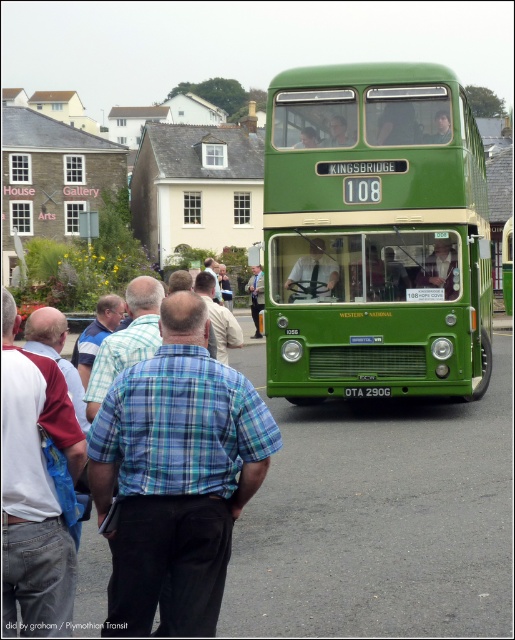
Does point (329, 356) lie in front of point (502, 241)?

Yes, point (329, 356) is in front of point (502, 241).

Can you confirm if green matte/deck bus at center is positioned to the right of green matte bus at center?

In fact, green matte/deck bus at center is to the left of green matte bus at center.

Locate an element on the screen. The width and height of the screenshot is (515, 640). green matte/deck bus at center is located at coordinates (374, 234).

Measure the distance between point [88,392] and camera.

They are 6.59 meters apart.

Between blue plaid shirt at center and blackmetalliclicense plate at lower center, which one has less height?

blackmetalliclicense plate at lower center

At what (x,y) coordinates should I click in order to perform the action: click on blue plaid shirt at center. Please return your answer as a coordinate pair (x, y). The height and width of the screenshot is (640, 515). Looking at the image, I should click on (166, 330).

At what (x,y) coordinates should I click in order to perform the action: click on blue plaid shirt at center. Please return your answer as a coordinate pair (x, y). Image resolution: width=515 pixels, height=640 pixels. Looking at the image, I should click on (166, 330).

Which is behind, point (505, 252) or point (389, 394)?

Point (505, 252)

From the picture: Who is shorter, green matte bus at center or blackmetalliclicense plate at lower center?

blackmetalliclicense plate at lower center

Does point (510, 288) come behind point (354, 397)?

Yes, it is.

Find the location of a particular element. green matte bus at center is located at coordinates (506, 266).